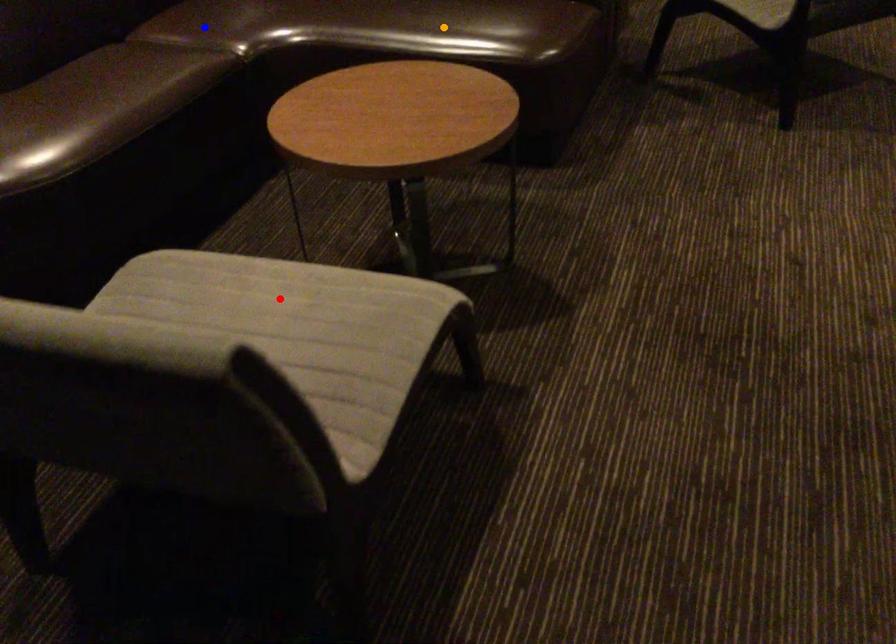
Consider the image. Order these from nearest to farthest:
1. blue point
2. orange point
3. red point

red point
orange point
blue point